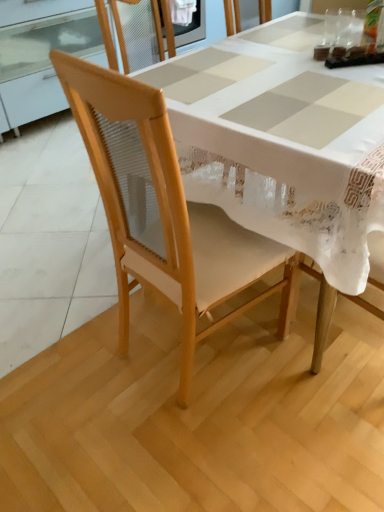
Locate an element on the screen. free space in front of transparent plastic cup at upper right, the 2th tableware from the right is located at coordinates (346, 50).